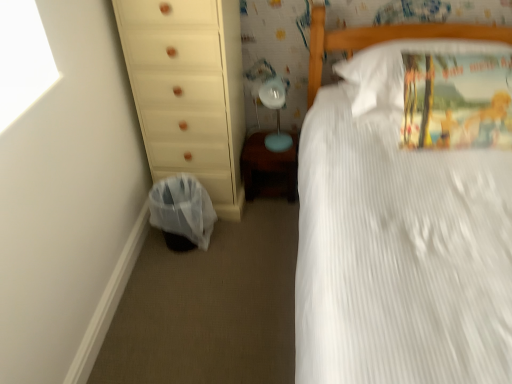
Question: Can you confirm if matte blue table lamp at center is smaller than plastic bag at lower left?

Choices:
 (A) no
 (B) yes

Answer: (B)

Question: From a real-world perspective, is matte blue table lamp at center on top of plastic bag at lower left?

Choices:
 (A) yes
 (B) no

Answer: (A)

Question: Is matte blue table lamp at center positioned before plastic bag at lower left?

Choices:
 (A) yes
 (B) no

Answer: (B)

Question: From a real-world perspective, does matte blue table lamp at center sit lower than plastic bag at lower left?

Choices:
 (A) no
 (B) yes

Answer: (A)

Question: Would you consider matte blue table lamp at center to be distant from plastic bag at lower left?

Choices:
 (A) yes
 (B) no

Answer: (B)

Question: Does matte blue table lamp at center have a greater height compared to plastic bag at lower left?

Choices:
 (A) yes
 (B) no

Answer: (A)

Question: Considering the relative positions of matte blue table lamp at center and white wood chest of drawers at left in the image provided, is matte blue table lamp at center in front of white wood chest of drawers at left?

Choices:
 (A) yes
 (B) no

Answer: (B)

Question: Is matte blue table lamp at center shorter than white wood chest of drawers at left?

Choices:
 (A) yes
 (B) no

Answer: (A)

Question: Is matte blue table lamp at center thinner than white wood chest of drawers at left?

Choices:
 (A) no
 (B) yes

Answer: (B)

Question: Is matte blue table lamp at center facing away from white wood chest of drawers at left?

Choices:
 (A) no
 (B) yes

Answer: (A)

Question: Is matte blue table lamp at center taller than white wood chest of drawers at left?

Choices:
 (A) no
 (B) yes

Answer: (A)

Question: From the image's perspective, is matte blue table lamp at center over white wood chest of drawers at left?

Choices:
 (A) yes
 (B) no

Answer: (B)

Question: Is white cotton pillow at upper right positioned in front of white wood chest of drawers at left?

Choices:
 (A) no
 (B) yes

Answer: (B)